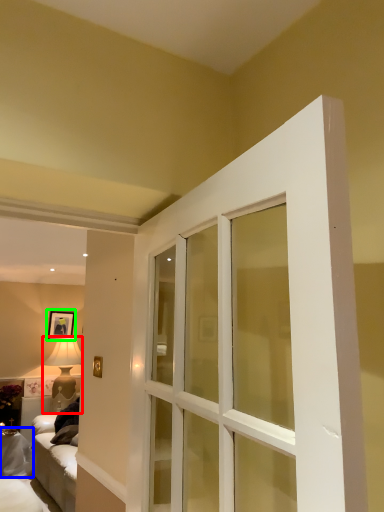
Question: Considering the real-world distances, which object is closest to lamp (highlighted by a red box)? furniture (highlighted by a blue box) or picture frame (highlighted by a green box).

Choices:
 (A) furniture
 (B) picture frame

Answer: (B)